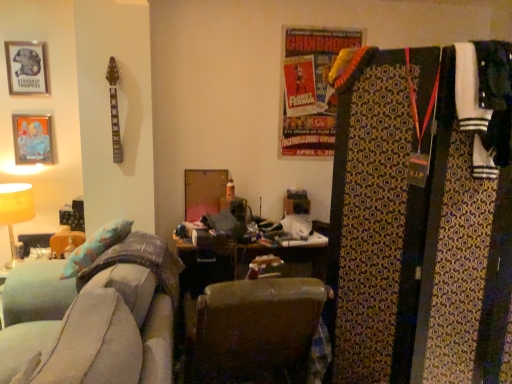
What do you see at coordinates (416, 228) in the screenshot?
I see `patterned fabric tie at right` at bounding box center [416, 228].

What do you see at coordinates (485, 102) in the screenshot? I see `white jersey at right` at bounding box center [485, 102].

This screenshot has height=384, width=512. What do you see at coordinates (258, 331) in the screenshot?
I see `leather at center` at bounding box center [258, 331].

Describe the element at coordinates (32, 139) in the screenshot. I see `metallic silver picture frame at upper left, which is the 1th picture frame in bottom-to-top order` at that location.

The image size is (512, 384). Describe the element at coordinates (26, 68) in the screenshot. I see `metallic silver picture frame at upper left, placed as the 1th picture frame when sorted from top to bottom` at that location.

This screenshot has height=384, width=512. Identify the location of patterned fabric tie at right. [x=416, y=228].

Is matte yellow table lamp at left wider than white jersey at right?

Yes.

Is matte yellow table lamp at left at the right side of white jersey at right?

Incorrect, matte yellow table lamp at left is not on the right side of white jersey at right.

Are matte yellow table lamp at left and white jersey at right making contact?

No, matte yellow table lamp at left is not next to white jersey at right.

Would you say matte yellow table lamp at left is inside or outside white jersey at right?

matte yellow table lamp at left lies outside white jersey at right.

From the picture: Is matte yellow table lamp at left with metallic silver picture frame at upper left, placed as the 1th picture frame when sorted from top to bottom?

There is a gap between matte yellow table lamp at left and metallic silver picture frame at upper left, placed as the 1th picture frame when sorted from top to bottom.

This screenshot has height=384, width=512. Identify the location of table lamp in front of the metallic silver picture frame at upper left, which is counted as the 2th picture frame, starting from the bottom. (15, 211).

Considering the relative sizes of matte yellow table lamp at left and metallic silver picture frame at upper left, placed as the 1th picture frame when sorted from top to bottom, in the image provided, is matte yellow table lamp at left smaller than metallic silver picture frame at upper left, placed as the 1th picture frame when sorted from top to bottom,?

No.

Which is further, (12, 222) or (14, 81)?

The point (12, 222) is more distant.

Would you say leather at center is inside or outside patterned fabric tie at right?

leather at center is spatially situated outside patterned fabric tie at right.

Is leather at center facing away from patterned fabric tie at right?

leather at center does not have its back to patterned fabric tie at right.

At what (x,y) coordinates should I click in order to perform the action: click on chair directly beneath the patterned fabric tie at right (from a real-world perspective). Please return your answer as a coordinate pair (x, y). The image size is (512, 384). Looking at the image, I should click on (258, 331).

Looking at this image, from the image's perspective, is leather at center beneath patterned fabric tie at right?

Yes.

From the image's perspective, who appears lower, metallic silver picture frame at upper left, which is the 1th picture frame in bottom-to-top order, or white jersey at right?

white jersey at right.

This screenshot has height=384, width=512. What are the coordinates of `clothing that is in front of the metallic silver picture frame at upper left, the 2th picture frame when ordered from top to bottom` in the screenshot? It's located at (485, 102).

Looking at this image, which of these two, metallic silver picture frame at upper left, which is the 1th picture frame in bottom-to-top order, or white jersey at right, stands taller?

With more height is white jersey at right.

From the picture: Can white jersey at right be found inside metallic silver picture frame at upper left, which is the 1th picture frame in bottom-to-top order?

Definitely not — white jersey at right is not inside metallic silver picture frame at upper left, which is the 1th picture frame in bottom-to-top order.

How different are the orientations of soft gray fabric couch at lower left and leather at center in degrees?

The facing directions of soft gray fabric couch at lower left and leather at center are 85.8 degrees apart.

Can you confirm if soft gray fabric couch at lower left is thinner than leather at center?

In fact, soft gray fabric couch at lower left might be wider than leather at center.

Is soft gray fabric couch at lower left beside leather at center?

No, soft gray fabric couch at lower left is not touching leather at center.

Which object is more forward, soft gray fabric couch at lower left or leather at center?

Positioned in front is soft gray fabric couch at lower left.

Are metallic silver picture frame at upper left, placed as the 1th picture frame when sorted from top to bottom, and matte yellow table lamp at left located far from each other?

Result: No, metallic silver picture frame at upper left, placed as the 1th picture frame when sorted from top to bottom, is not far away from matte yellow table lamp at left.

From the picture: From the image's perspective, is metallic silver picture frame at upper left, which is counted as the 2th picture frame, starting from the bottom, located beneath matte yellow table lamp at left?

No.

Looking at this image, is metallic silver picture frame at upper left, placed as the 1th picture frame when sorted from top to bottom, smaller than matte yellow table lamp at left?

Yes, metallic silver picture frame at upper left, placed as the 1th picture frame when sorted from top to bottom, is smaller than matte yellow table lamp at left.

From the picture: How much distance is there between white jersey at right and patterned fabric tie at right?

white jersey at right and patterned fabric tie at right are 11.32 inches apart.

Is white jersey at right directly adjacent to patterned fabric tie at right?

No.

Is white jersey at right facing away from patterned fabric tie at right?

Yes, white jersey at right's orientation is away from patterned fabric tie at right.

Is white jersey at right further to camera compared to patterned fabric tie at right?

No, it is in front of patterned fabric tie at right.

Image resolution: width=512 pixels, height=384 pixels. I want to click on table lamp that appears on the left of white jersey at right, so click(x=15, y=211).

Which picture frame is the 1st one when counting from the back of the matte yellow table lamp at left? Please provide its 2D coordinates.

[(26, 68)]

From the image, which object appears to be farther from soft gray fabric couch at lower left, matte yellow table lamp at left or metallic silver picture frame at upper left, which is counted as the 2th picture frame, starting from the bottom?

The object further to soft gray fabric couch at lower left is metallic silver picture frame at upper left, which is counted as the 2th picture frame, starting from the bottom.

From the picture: Based on their spatial positions, is leather at center or soft gray fabric couch at lower left closer to white jersey at right?

Among the two, leather at center is located nearer to white jersey at right.

From the image, which object appears to be farther from metallic silver picture frame at upper left, placed as the 1th picture frame when sorted from top to bottom, metallic silver picture frame at upper left, which is the 1th picture frame in bottom-to-top order, or white jersey at right?

white jersey at right lies further to metallic silver picture frame at upper left, placed as the 1th picture frame when sorted from top to bottom, than the other object.

Considering their positions, is metallic silver picture frame at upper left, which is the 1th picture frame in bottom-to-top order, positioned further to metallic silver picture frame at upper left, placed as the 1th picture frame when sorted from top to bottom, than leather at center?

leather at center is positioned further to the anchor metallic silver picture frame at upper left, placed as the 1th picture frame when sorted from top to bottom.

From the picture: Based on their spatial positions, is metallic silver picture frame at upper left, placed as the 1th picture frame when sorted from top to bottom, or metallic silver picture frame at upper left, which is the 1th picture frame in bottom-to-top order, further from soft gray fabric couch at lower left?

The object further to soft gray fabric couch at lower left is metallic silver picture frame at upper left, placed as the 1th picture frame when sorted from top to bottom.

Considering their positions, is white jersey at right positioned closer to soft gray fabric couch at lower left than metallic silver picture frame at upper left, which is counted as the 2th picture frame, starting from the bottom?

white jersey at right lies closer to soft gray fabric couch at lower left than the other object.

Looking at this image, which object lies nearer to the anchor point leather at center, soft gray fabric couch at lower left or matte yellow table lamp at left?

Among the two, soft gray fabric couch at lower left is located nearer to leather at center.

From the image, which object appears to be farther from metallic silver picture frame at upper left, the 2th picture frame when ordered from top to bottom, leather at center or metallic silver picture frame at upper left, which is counted as the 2th picture frame, starting from the bottom?

leather at center.

The width and height of the screenshot is (512, 384). I want to click on chair between metallic silver picture frame at upper left, which is the 1th picture frame in bottom-to-top order, and white jersey at right, in the horizontal direction, so click(258, 331).

Identify the location of dresser between white jersey at right and leather at center vertically. (416, 228).

This screenshot has width=512, height=384. I want to click on chair between metallic silver picture frame at upper left, placed as the 1th picture frame when sorted from top to bottom, and patterned fabric tie at right, in the horizontal direction, so click(x=258, y=331).

Find the location of a particular element. The image size is (512, 384). dresser situated between soft gray fabric couch at lower left and white jersey at right from left to right is located at coordinates (416, 228).